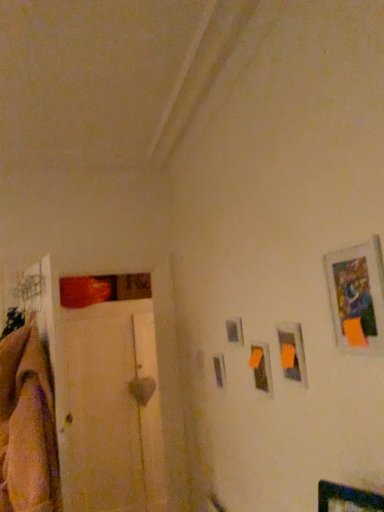
Question: From their relative heights in the image, would you say matte plastic picture frame at upper right, placed as the third picture frame when sorted from back to front, is taller or shorter than white wood door at left?

Choices:
 (A) short
 (B) tall

Answer: (A)

Question: Relative to white wood door at left, is matte plastic picture frame at upper right, acting as the 3th picture frame starting from the left, in front or behind?

Choices:
 (A) behind
 (B) front

Answer: (B)

Question: Which object is the closest to the metallic silver picture frame at center-right, the 1th picture frame viewed from the back?

Choices:
 (A) white wood door at left
 (B) matte plastic picture frame at center, which is the 2th picture frame from left to right
 (C) matte plastic picture frame at upper right, acting as the 3th picture frame starting from the left
 (D) metallic silver picture frame at upper right, the 1th picture frame viewed from the right
 (E) soft beige blanket at left

Answer: (B)

Question: Based on their relative distances, which object is farther from the matte plastic picture frame at center, which is the third picture frame from front to back?

Choices:
 (A) white wood door at left
 (B) matte plastic picture frame at upper right, acting as the 3th picture frame starting from the left
 (C) metallic silver picture frame at upper right, acting as the first picture frame starting from the front
 (D) soft beige blanket at left
 (E) metallic silver picture frame at center-right, the 1th picture frame viewed from the left

Answer: (A)